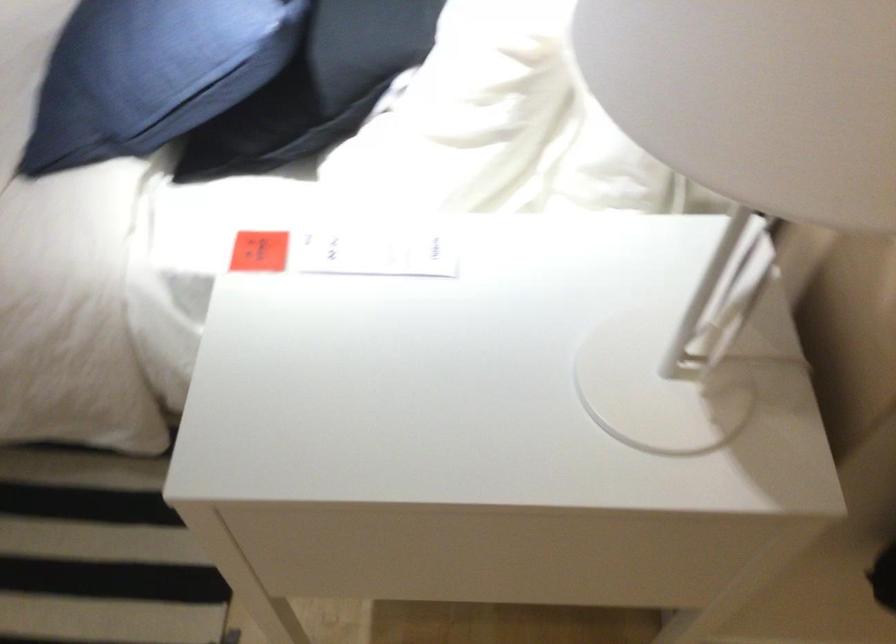
Identify the location of white lamp head. (762, 99).